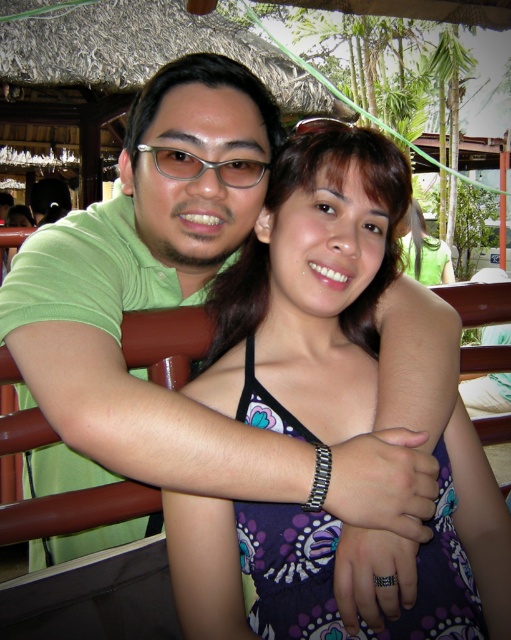
Which of these two, purple printed dress at center or clear plastic glasses at upper center, stands taller?

Standing taller between the two is purple printed dress at center.

You are a GUI agent. You are given a task and a screenshot of the screen. Output one action in this format:
    pyautogui.click(x=<x>, y=<y>)
    Task: Click on the purple printed dress at center
    The width and height of the screenshot is (511, 640).
    Given the screenshot: What is the action you would take?
    pyautogui.click(x=311, y=289)